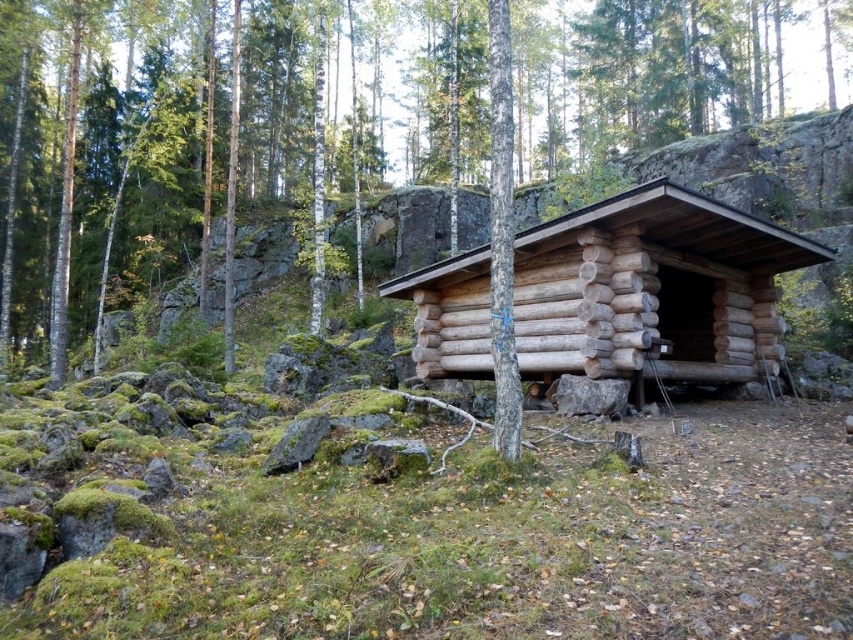
You are planning to build a new cabin in the forest. You have two options for the cabin design based on the image provided. The first option is the brown wood log cabin at center, and the second is the natural wood log cabin at center. Considering the space available in the rugged terrain, which cabin would require more horizontal space due to its width?

The brown wood log cabin at center requires more horizontal space because its width surpasses that of the natural wood log cabin at center.